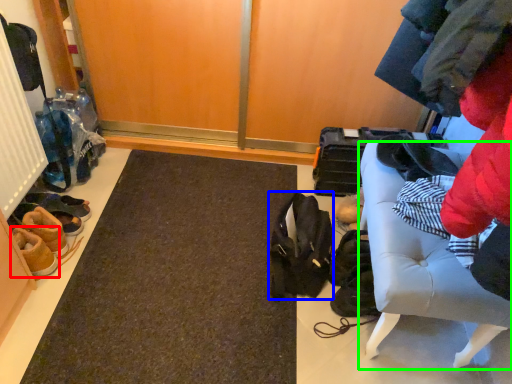
Question: Based on their relative distances, which object is nearer to footwear (highlighted by a red box)? Choose from shoulder bag (highlighted by a blue box) and furniture (highlighted by a green box).

Choices:
 (A) shoulder bag
 (B) furniture

Answer: (A)